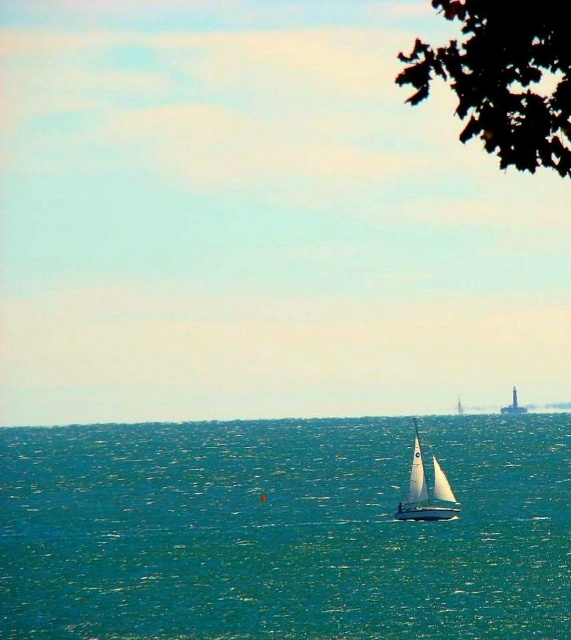
Between point (494, 60) and point (433, 506), which one is positioned in front?

Point (494, 60) is in front.

Is point (477, 83) positioned before point (421, 464)?

Yes, it is.

The image size is (571, 640). Identify the location of green leafy tree at upper right. (504, 77).

Does teal water at center come in front of green leafy tree at upper right?

That is False.

Is teal water at center wider than green leafy tree at upper right?

Correct, the width of teal water at center exceeds that of green leafy tree at upper right.

Is point (175, 486) closer to camera compared to point (477, 8)?

That is False.

At what (x,y) coordinates should I click in order to perform the action: click on teal water at center. Please return your answer as a coordinate pair (x, y). Looking at the image, I should click on (283, 531).

Is teal water at center shorter than white sailboat at center?

In fact, teal water at center may be taller than white sailboat at center.

Can you confirm if teal water at center is bigger than white sailboat at center?

Yes.

Locate an element on the screen. Image resolution: width=571 pixels, height=640 pixels. teal water at center is located at coordinates (283, 531).

Identify the location of teal water at center. This screenshot has height=640, width=571. (283, 531).